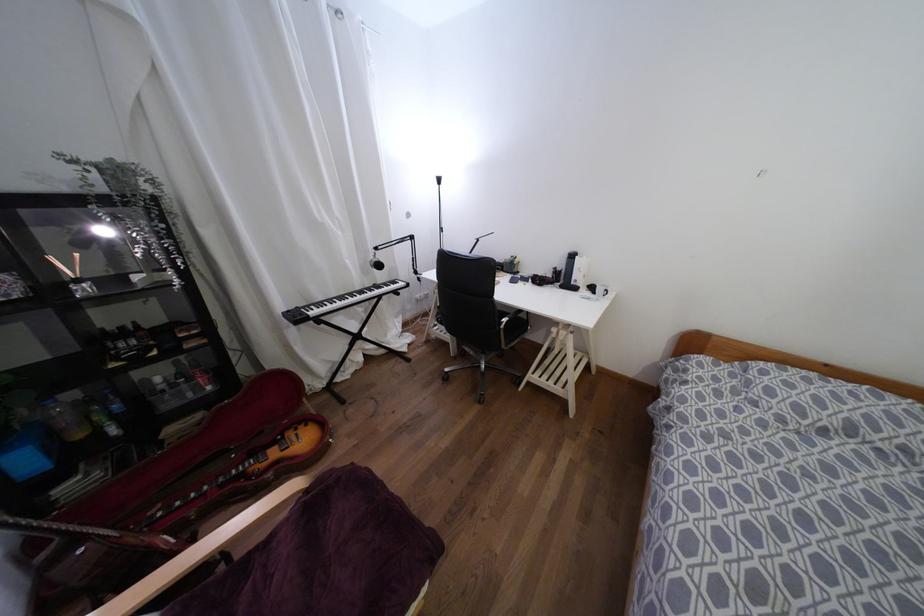
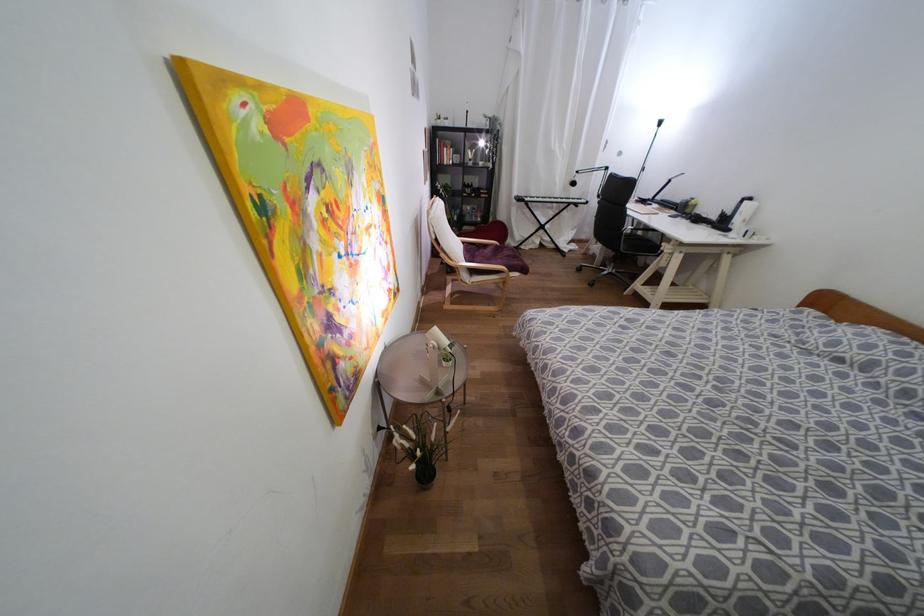
Locate, in the second image, the point that corresponds to [379,265] in the first image.

(573, 183)